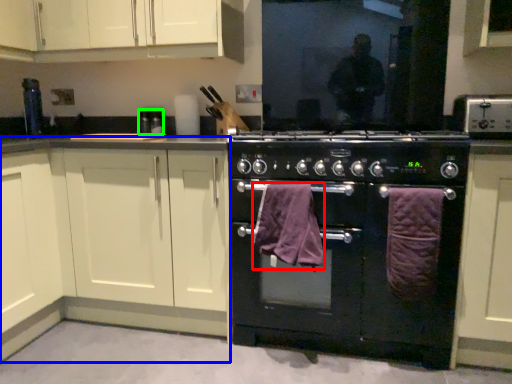
Question: Considering the real-world distances, which object is closest to bath towel (highlighted by a red box)? cabinetry (highlighted by a blue box) or appliance (highlighted by a green box).

Choices:
 (A) cabinetry
 (B) appliance

Answer: (A)